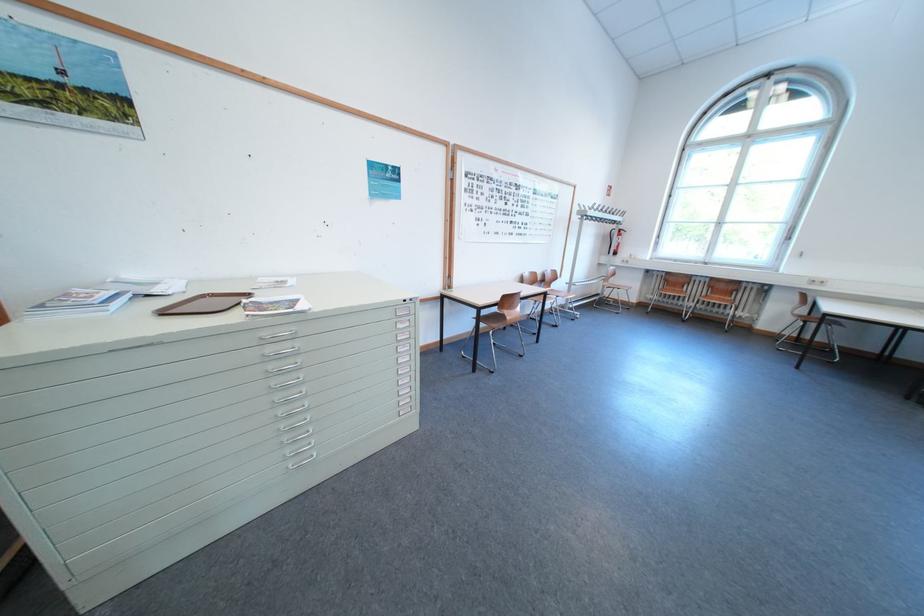
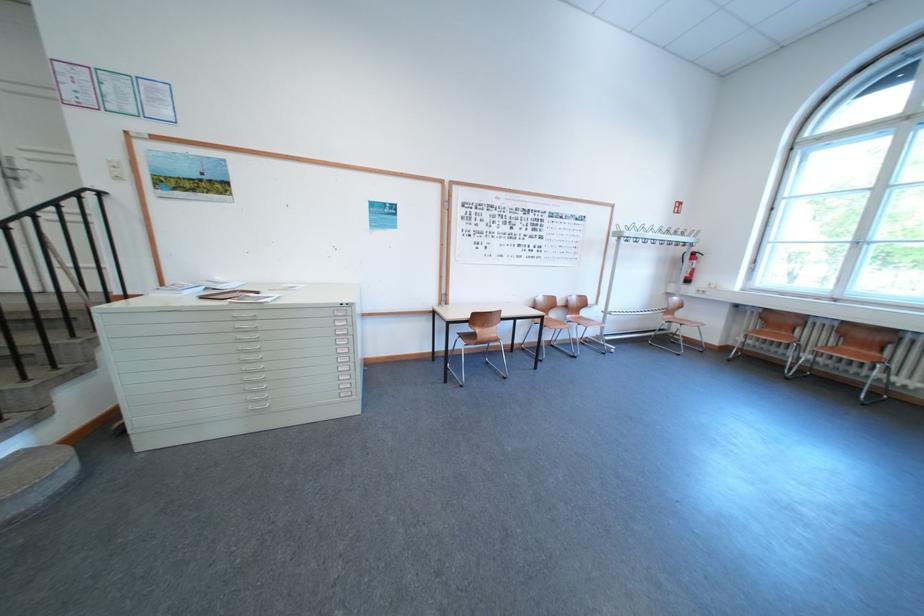
Question: Which direction would the cameraman need to move to produce the second image? Reply with the corresponding letter.

Choices:
 (A) Left
 (B) Right
 (C) Forward
 (D) Backward

Answer: (B)